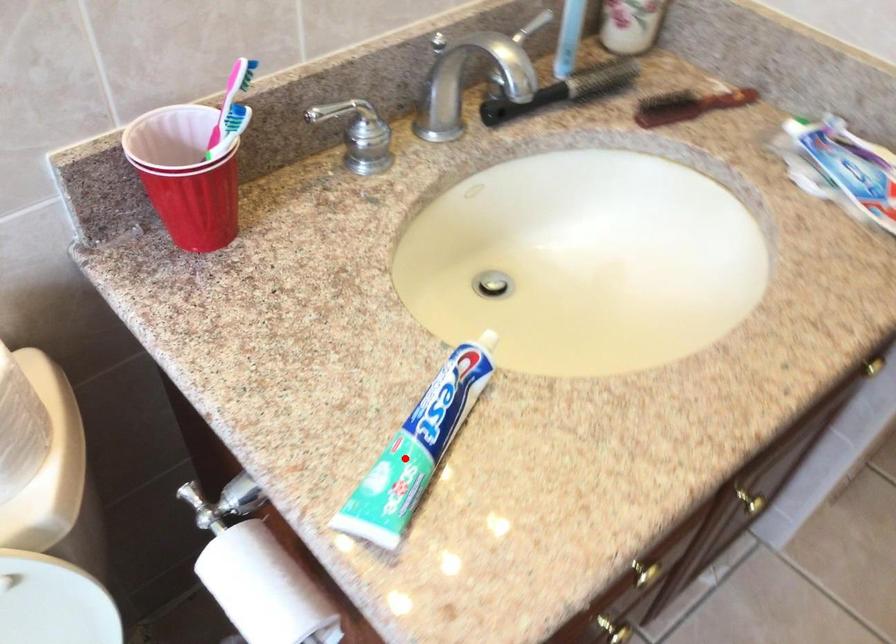
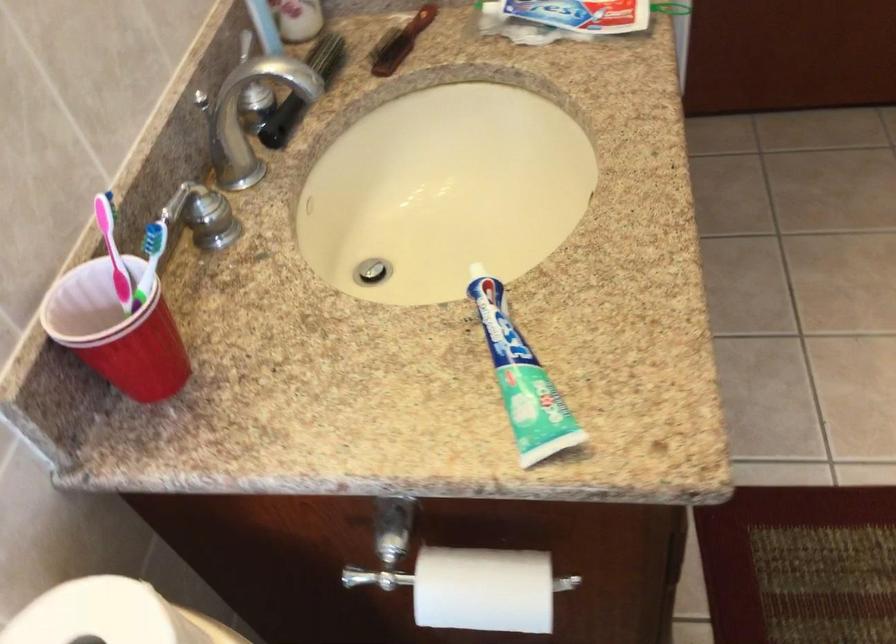
Question: A red point is marked in image1. In image2, is the corresponding 3D point closer to the camera or farther? Reply with the corresponding letter.

Choices:
 (A) The corresponding 3D point is closer.
 (B) The corresponding 3D point is farther.

Answer: (B)